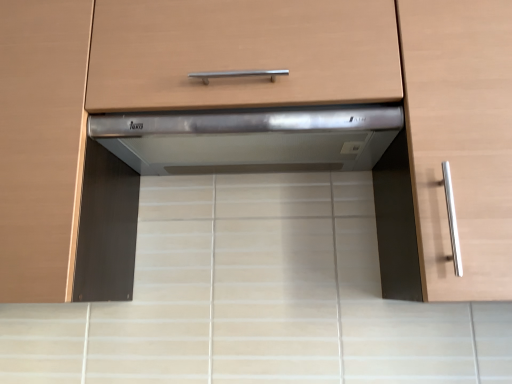
This screenshot has width=512, height=384. Describe the element at coordinates (460, 140) in the screenshot. I see `satin wood cabinet handle at right, arranged as the second cabinetry when viewed from the left` at that location.

Describe the element at coordinates (241, 53) in the screenshot. The width and height of the screenshot is (512, 384). I see `satin silver drawer at center` at that location.

This screenshot has height=384, width=512. In order to click on satin silver drawer at center in this screenshot , I will do click(241, 53).

Where is `satin wood cabinet handle at right, arranged as the second cabinetry when viewed from the left`? This screenshot has width=512, height=384. satin wood cabinet handle at right, arranged as the second cabinetry when viewed from the left is located at coordinates (460, 140).

Could you tell me if satin wood cabinet handle at right, the 1th cabinetry when ordered from right to left, is turned towards satin silver range hood at center?

No, satin wood cabinet handle at right, the 1th cabinetry when ordered from right to left, is not aimed at satin silver range hood at center.

In the scene shown: Is satin silver range hood at center inside satin wood cabinet handle at right, arranged as the second cabinetry when viewed from the left?

No, satin wood cabinet handle at right, arranged as the second cabinetry when viewed from the left, does not contain satin silver range hood at center.

From a real-world perspective, between satin wood cabinet handle at right, arranged as the second cabinetry when viewed from the left, and satin silver range hood at center, who is vertically lower?

satin silver range hood at center is physically lower.

Is satin wood cabinet handle at right, arranged as the second cabinetry when viewed from the left, positioned before satin silver range hood at center?

Yes, satin wood cabinet handle at right, arranged as the second cabinetry when viewed from the left, is closer to the camera.

Is satin silver metallic range hood at center, marked as the 1th cabinetry in a left-to-right arrangement, completely or partially outside of satin silver range hood at center?

satin silver metallic range hood at center, marked as the 1th cabinetry in a left-to-right arrangement, lies outside satin silver range hood at center's area.

Is satin silver metallic range hood at center, marked as the 1th cabinetry in a left-to-right arrangement, placed right next to satin silver range hood at center?

No, satin silver metallic range hood at center, marked as the 1th cabinetry in a left-to-right arrangement, is not making contact with satin silver range hood at center.

Is satin silver range hood at center at the back of satin silver metallic range hood at center, marked as the 1th cabinetry in a left-to-right arrangement?

satin silver metallic range hood at center, marked as the 1th cabinetry in a left-to-right arrangement, is not turned away from satin silver range hood at center.

From a real-world perspective, who is located lower, satin silver metallic range hood at center, the second cabinetry viewed from the right, or satin silver range hood at center?

satin silver range hood at center, from a real-world perspective.

From a real-world perspective, is satin silver metallic range hood at center, the second cabinetry viewed from the right, positioned above or below satin silver drawer at center?

In terms of real-world spatial position, satin silver metallic range hood at center, the second cabinetry viewed from the right, is below satin silver drawer at center.

Is satin silver metallic range hood at center, marked as the 1th cabinetry in a left-to-right arrangement, positioned with its back to satin silver drawer at center?

No, satin silver drawer at center is not at the back of satin silver metallic range hood at center, marked as the 1th cabinetry in a left-to-right arrangement.

Who is taller, satin silver metallic range hood at center, the second cabinetry viewed from the right, or satin silver drawer at center?

satin silver metallic range hood at center, the second cabinetry viewed from the right, is taller.

Does satin silver drawer at center have a greater width compared to satin wood cabinet handle at right, arranged as the second cabinetry when viewed from the left?

In fact, satin silver drawer at center might be narrower than satin wood cabinet handle at right, arranged as the second cabinetry when viewed from the left.

Is satin silver drawer at center spatially inside satin wood cabinet handle at right, arranged as the second cabinetry when viewed from the left, or outside of it?

The correct answer is: outside.

Is satin silver drawer at center turned away from satin wood cabinet handle at right, arranged as the second cabinetry when viewed from the left?

satin silver drawer at center is not turned away from satin wood cabinet handle at right, arranged as the second cabinetry when viewed from the left.

Is satin silver drawer at center shorter than satin wood cabinet handle at right, the 1th cabinetry when ordered from right to left?

Indeed, satin silver drawer at center has a lesser height compared to satin wood cabinet handle at right, the 1th cabinetry when ordered from right to left.

How many degrees apart are the facing directions of satin silver range hood at center and satin silver metallic range hood at center, marked as the 1th cabinetry in a left-to-right arrangement?

The facing directions of satin silver range hood at center and satin silver metallic range hood at center, marked as the 1th cabinetry in a left-to-right arrangement, are 4.07e-05 degrees apart.

Is point (132, 144) less distant than point (30, 224)?

No, it is behind (30, 224).

Is satin silver range hood at center positioned beyond the bounds of satin silver metallic range hood at center, the second cabinetry viewed from the right?

Absolutely, satin silver range hood at center is external to satin silver metallic range hood at center, the second cabinetry viewed from the right.

Which of these two, satin silver range hood at center or satin wood cabinet handle at right, arranged as the second cabinetry when viewed from the left, is smaller?

Smaller between the two is satin silver range hood at center.

Is satin wood cabinet handle at right, the 1th cabinetry when ordered from right to left, inside satin silver range hood at center?

No, satin silver range hood at center does not contain satin wood cabinet handle at right, the 1th cabinetry when ordered from right to left.

Does satin silver range hood at center have a greater width compared to satin wood cabinet handle at right, the 1th cabinetry when ordered from right to left?

In fact, satin silver range hood at center might be narrower than satin wood cabinet handle at right, the 1th cabinetry when ordered from right to left.

Is satin silver range hood at center completely or partially outside of satin silver drawer at center?

Yes, satin silver range hood at center is outside of satin silver drawer at center.

This screenshot has height=384, width=512. What are the coordinates of `drawer in front of the satin silver range hood at center` in the screenshot? It's located at (x=241, y=53).

Looking at this image, who is shorter, satin silver range hood at center or satin silver drawer at center?

With less height is satin silver range hood at center.

Image resolution: width=512 pixels, height=384 pixels. In order to click on the 2nd cabinetry positioned above the satin silver range hood at center (from a real-world perspective) in this screenshot , I will do `click(460, 140)`.

Where is `cabinetry that is the 1st object located in front of the satin silver range hood at center`? This screenshot has width=512, height=384. cabinetry that is the 1st object located in front of the satin silver range hood at center is located at coordinates (41, 144).

Based on their spatial positions, is satin silver metallic range hood at center, marked as the 1th cabinetry in a left-to-right arrangement, or satin silver drawer at center further from satin wood cabinet handle at right, arranged as the second cabinetry when viewed from the left?

satin silver metallic range hood at center, marked as the 1th cabinetry in a left-to-right arrangement, lies further to satin wood cabinet handle at right, arranged as the second cabinetry when viewed from the left, than the other object.

Looking at the image, which one is located closer to satin silver metallic range hood at center, the second cabinetry viewed from the right, satin silver range hood at center or satin silver drawer at center?

The object closer to satin silver metallic range hood at center, the second cabinetry viewed from the right, is satin silver drawer at center.

Based on the photo, when comparing their distances from satin silver range hood at center, does satin silver drawer at center or satin wood cabinet handle at right, the 1th cabinetry when ordered from right to left, seem closer?

The object closer to satin silver range hood at center is satin silver drawer at center.

Looking at the image, which one is located further to satin wood cabinet handle at right, the 1th cabinetry when ordered from right to left, satin silver drawer at center or satin silver metallic range hood at center, marked as the 1th cabinetry in a left-to-right arrangement?

satin silver metallic range hood at center, marked as the 1th cabinetry in a left-to-right arrangement, is positioned further to the anchor satin wood cabinet handle at right, the 1th cabinetry when ordered from right to left.

Based on their spatial positions, is satin silver metallic range hood at center, the second cabinetry viewed from the right, or satin silver drawer at center further from satin silver range hood at center?

The object further to satin silver range hood at center is satin silver metallic range hood at center, the second cabinetry viewed from the right.

Considering their positions, is satin wood cabinet handle at right, arranged as the second cabinetry when viewed from the left, positioned closer to satin silver metallic range hood at center, the second cabinetry viewed from the right, than satin silver drawer at center?

Based on the image, satin silver drawer at center appears to be nearer to satin silver metallic range hood at center, the second cabinetry viewed from the right.

Considering their positions, is satin silver drawer at center positioned closer to satin silver metallic range hood at center, marked as the 1th cabinetry in a left-to-right arrangement, than satin silver range hood at center?

satin silver drawer at center lies closer to satin silver metallic range hood at center, marked as the 1th cabinetry in a left-to-right arrangement, than the other object.

Considering their positions, is satin silver range hood at center positioned further to satin wood cabinet handle at right, the 1th cabinetry when ordered from right to left, than satin silver drawer at center?

satin silver range hood at center is further to satin wood cabinet handle at right, the 1th cabinetry when ordered from right to left.

Where is `home appliance between satin silver metallic range hood at center, marked as the 1th cabinetry in a left-to-right arrangement, and satin wood cabinet handle at right, the 1th cabinetry when ordered from right to left, in the horizontal direction`? The image size is (512, 384). home appliance between satin silver metallic range hood at center, marked as the 1th cabinetry in a left-to-right arrangement, and satin wood cabinet handle at right, the 1th cabinetry when ordered from right to left, in the horizontal direction is located at coordinates (250, 138).

Where is `home appliance between satin silver drawer at center and satin wood cabinet handle at right, the 1th cabinetry when ordered from right to left`? home appliance between satin silver drawer at center and satin wood cabinet handle at right, the 1th cabinetry when ordered from right to left is located at coordinates (250, 138).

This screenshot has width=512, height=384. What are the coordinates of `drawer between satin silver metallic range hood at center, the second cabinetry viewed from the right, and satin wood cabinet handle at right, the 1th cabinetry when ordered from right to left, from left to right` in the screenshot? It's located at (241, 53).

You are a GUI agent. You are given a task and a screenshot of the screen. Output one action in this format:
    pyautogui.click(x=<x>, y=<y>)
    Task: Click on the drawer between satin silver metallic range hood at center, the second cabinetry viewed from the right, and satin silver range hood at center from left to right
    
    Given the screenshot: What is the action you would take?
    pyautogui.click(x=241, y=53)